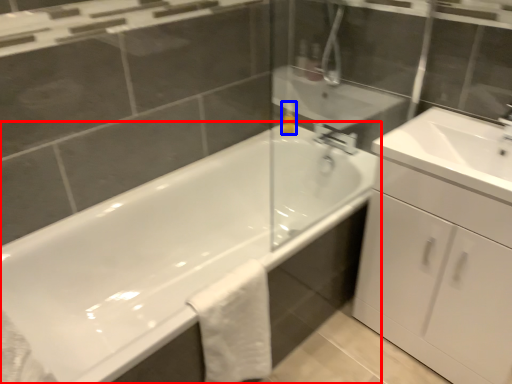
Question: Which point is further to the camera, bathtub (highlighted by a red box) or soap dispenser (highlighted by a blue box)?

Choices:
 (A) bathtub
 (B) soap dispenser

Answer: (B)